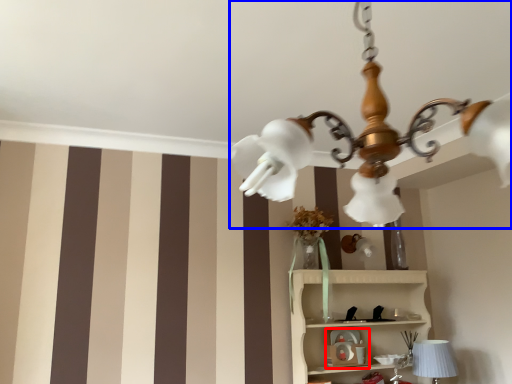
Question: Which object appears closest to the camera in this image, toy (highlighted by a red box) or lamp (highlighted by a blue box)?

Choices:
 (A) toy
 (B) lamp

Answer: (B)